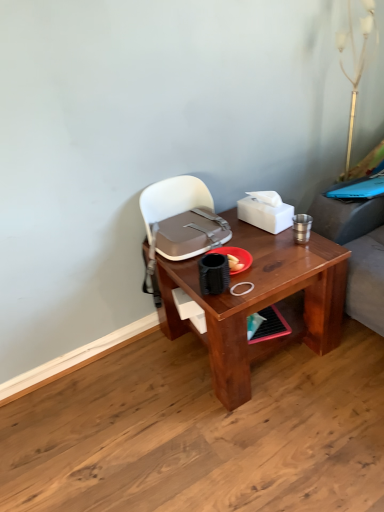
Question: Does matte gray handbag at center lie in front of brown wooden desk at center?

Choices:
 (A) no
 (B) yes

Answer: (A)

Question: From a real-world perspective, does matte gray handbag at center stand above brown wooden desk at center?

Choices:
 (A) no
 (B) yes

Answer: (B)

Question: From the image's perspective, is matte gray handbag at center located beneath brown wooden desk at center?

Choices:
 (A) yes
 (B) no

Answer: (B)

Question: Can you confirm if matte gray handbag at center is positioned to the left of brown wooden desk at center?

Choices:
 (A) no
 (B) yes

Answer: (B)

Question: Is matte gray handbag at center facing away from brown wooden desk at center?

Choices:
 (A) yes
 (B) no

Answer: (A)

Question: Could you tell me if matte gray handbag at center is facing brown wooden desk at center?

Choices:
 (A) yes
 (B) no

Answer: (A)

Question: Is matte gray handbag at center not inside gold metallic table lamp at upper right?

Choices:
 (A) yes
 (B) no

Answer: (A)

Question: Is matte gray handbag at center closer to camera compared to gold metallic table lamp at upper right?

Choices:
 (A) no
 (B) yes

Answer: (B)

Question: Is the depth of matte gray handbag at center greater than that of gold metallic table lamp at upper right?

Choices:
 (A) yes
 (B) no

Answer: (B)

Question: Could gold metallic table lamp at upper right be considered to be inside matte gray handbag at center?

Choices:
 (A) no
 (B) yes

Answer: (A)

Question: From the image's perspective, does matte gray handbag at center appear higher than gold metallic table lamp at upper right?

Choices:
 (A) no
 (B) yes

Answer: (A)

Question: Would you say matte gray handbag at center is a long distance from gold metallic table lamp at upper right?

Choices:
 (A) yes
 (B) no

Answer: (A)

Question: From the image's perspective, is gold metallic table lamp at upper right over matte gray handbag at center?

Choices:
 (A) yes
 (B) no

Answer: (A)